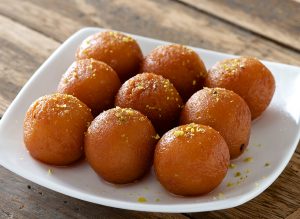
Where is `light surface`? light surface is located at coordinates (221, 36), (185, 21).